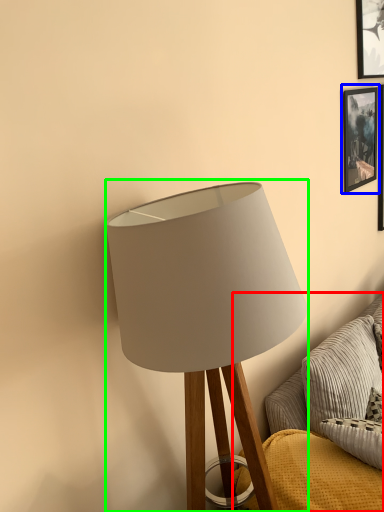
Question: Which object is positioned closest to couch (highlighted by a red box)? Select from picture frame (highlighted by a blue box) and lamp (highlighted by a green box).

Choices:
 (A) picture frame
 (B) lamp

Answer: (B)